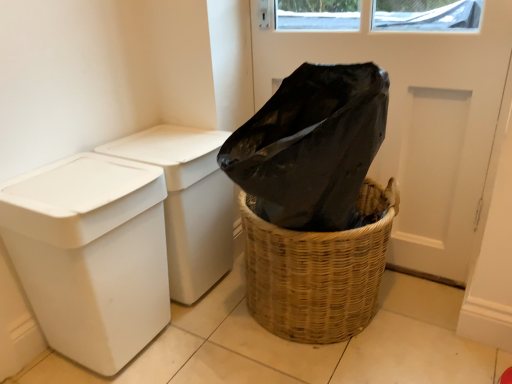
Where is `white plastic bin at left, marked as the 1th waste container in a back-to-front arrangement`? Image resolution: width=512 pixels, height=384 pixels. white plastic bin at left, marked as the 1th waste container in a back-to-front arrangement is located at coordinates pos(188,203).

In the image, is white plastic bin at left, which is the 1th waste container in front-to-back order, on the left side or the right side of black plastic screen door at upper center?

From the image, it's evident that white plastic bin at left, which is the 1th waste container in front-to-back order, is to the left of black plastic screen door at upper center.

From the image's perspective, would you say white plastic bin at left, which is counted as the second waste container, starting from the back, is shown under black plastic screen door at upper center?

Yes, from the image's perspective, white plastic bin at left, which is counted as the second waste container, starting from the back, is beneath black plastic screen door at upper center.

Considering the sizes of objects white plastic bin at left, which is the 1th waste container in front-to-back order, and black plastic screen door at upper center in the image provided, who is thinner, white plastic bin at left, which is the 1th waste container in front-to-back order, or black plastic screen door at upper center?

With smaller width is black plastic screen door at upper center.

Considering their positions, is white plastic bin at left, which is the 1th waste container in front-to-back order, located in front of or behind black plastic screen door at upper center?

Visually, white plastic bin at left, which is the 1th waste container in front-to-back order, is located in front of black plastic screen door at upper center.

From a real-world perspective, who is located lower, white plastic bin at left, which is the 2th waste container from front to back, or white plastic bin at left, which is counted as the second waste container, starting from the back?

white plastic bin at left, which is the 2th waste container from front to back.

Can you confirm if white plastic bin at left, marked as the 1th waste container in a back-to-front arrangement, is thinner than white plastic bin at left, which is the 1th waste container in front-to-back order?

Indeed, white plastic bin at left, marked as the 1th waste container in a back-to-front arrangement, has a lesser width compared to white plastic bin at left, which is the 1th waste container in front-to-back order.

Would you say white plastic bin at left, marked as the 1th waste container in a back-to-front arrangement, contains white plastic bin at left, which is counted as the second waste container, starting from the back?

Definitely not — white plastic bin at left, which is counted as the second waste container, starting from the back, is not inside white plastic bin at left, marked as the 1th waste container in a back-to-front arrangement.

Considering the positions of objects white plastic bin at left, marked as the 1th waste container in a back-to-front arrangement, and white plastic bin at left, which is counted as the second waste container, starting from the back, in the image provided, who is more to the left, white plastic bin at left, marked as the 1th waste container in a back-to-front arrangement, or white plastic bin at left, which is counted as the second waste container, starting from the back,?

From the viewer's perspective, white plastic bin at left, which is counted as the second waste container, starting from the back, appears more on the left side.

From a real-world perspective, who is located lower, white plastic bin at left, which is the 2th waste container from front to back, or woven brown basket at lower right?

woven brown basket at lower right.

From the image's perspective, which object appears higher, white plastic bin at left, marked as the 1th waste container in a back-to-front arrangement, or woven brown basket at lower right?

From the image's view, white plastic bin at left, marked as the 1th waste container in a back-to-front arrangement, is above.

Based on the photo, which object is further away from the camera, white plastic bin at left, which is the 2th waste container from front to back, or woven brown basket at lower right?

white plastic bin at left, which is the 2th waste container from front to back, is more distant.

Is woven brown basket at lower right surrounding black plastic screen door at upper center?

No, black plastic screen door at upper center is not a part of woven brown basket at lower right.

Does point (309, 280) appear closer or farther from the camera than point (505, 6)?

Point (309, 280) is farther from the camera than point (505, 6).

Considering the relative sizes of woven brown basket at lower right and black plastic screen door at upper center in the image provided, is woven brown basket at lower right thinner than black plastic screen door at upper center?

No, woven brown basket at lower right is not thinner than black plastic screen door at upper center.

Are woven brown basket at lower right and black plastic screen door at upper center far apart?

No, woven brown basket at lower right is in close proximity to black plastic screen door at upper center.

Is black plastic screen door at upper center turned away from white plastic bin at left, which is the 1th waste container in front-to-back order?

No, white plastic bin at left, which is the 1th waste container in front-to-back order, is not at the back of black plastic screen door at upper center.

Is point (451, 172) positioned before point (156, 318)?

No, (451, 172) is further to viewer.

What are the coordinates of `waste container in front of the black plastic screen door at upper center` in the screenshot? It's located at (91, 255).

Are black plastic screen door at upper center and white plastic bin at left, which is the 1th waste container in front-to-back order, beside each other?

They are not placed beside each other.

Between woven brown basket at lower right and white plastic bin at left, which is counted as the second waste container, starting from the back, which one is positioned in front?

white plastic bin at left, which is counted as the second waste container, starting from the back, is more forward.

Could you measure the distance between woven brown basket at lower right and white plastic bin at left, which is the 1th waste container in front-to-back order?

woven brown basket at lower right is 17.95 inches from white plastic bin at left, which is the 1th waste container in front-to-back order.

Is woven brown basket at lower right positioned with its back to white plastic bin at left, which is counted as the second waste container, starting from the back?

That's not correct — woven brown basket at lower right is not looking away from white plastic bin at left, which is counted as the second waste container, starting from the back.

Considering the points (387, 200) and (60, 219), which point is behind, point (387, 200) or point (60, 219)?

Point (387, 200)

Between point (119, 163) and point (229, 195), which one is positioned in front?

Point (119, 163)

Is white plastic bin at left, which is counted as the second waste container, starting from the back, bigger than white plastic bin at left, which is the 2th waste container from front to back?

Yes, white plastic bin at left, which is counted as the second waste container, starting from the back, is bigger than white plastic bin at left, which is the 2th waste container from front to back.

From the image's perspective, who appears lower, white plastic bin at left, which is the 1th waste container in front-to-back order, or white plastic bin at left, marked as the 1th waste container in a back-to-front arrangement?

From the image's view, white plastic bin at left, which is the 1th waste container in front-to-back order, is below.

At what (x,y) coordinates should I click in order to perform the action: click on waste container that appears on the right of white plastic bin at left, which is the 1th waste container in front-to-back order. Please return your answer as a coordinate pair (x, y). The height and width of the screenshot is (384, 512). Looking at the image, I should click on (188, 203).

Find the location of a particular element. The width and height of the screenshot is (512, 384). screen door above the white plastic bin at left, which is the 1th waste container in front-to-back order (from a real-world perspective) is located at coordinates (415, 114).

What are the coordinates of `waste container on the left of white plastic bin at left, marked as the 1th waste container in a back-to-front arrangement` in the screenshot? It's located at (91, 255).

Estimate the real-world distances between objects in this image. Which object is closer to white plastic bin at left, which is the 2th waste container from front to back, white plastic bin at left, which is the 1th waste container in front-to-back order, or woven brown basket at lower right?

Among the two, white plastic bin at left, which is the 1th waste container in front-to-back order, is located nearer to white plastic bin at left, which is the 2th waste container from front to back.

From the image, which object appears to be nearer to white plastic bin at left, which is the 1th waste container in front-to-back order, black plastic screen door at upper center or woven brown basket at lower right?

Based on the image, woven brown basket at lower right appears to be nearer to white plastic bin at left, which is the 1th waste container in front-to-back order.

From the image, which object appears to be farther from black plastic screen door at upper center, white plastic bin at left, which is the 2th waste container from front to back, or woven brown basket at lower right?

The object further to black plastic screen door at upper center is white plastic bin at left, which is the 2th waste container from front to back.

From the image, which object appears to be farther from white plastic bin at left, which is counted as the second waste container, starting from the back, black plastic screen door at upper center or white plastic bin at left, which is the 2th waste container from front to back?

Among the two, black plastic screen door at upper center is located further to white plastic bin at left, which is counted as the second waste container, starting from the back.

Which object lies further to the anchor point white plastic bin at left, marked as the 1th waste container in a back-to-front arrangement, black plastic screen door at upper center or white plastic bin at left, which is the 1th waste container in front-to-back order?

black plastic screen door at upper center lies further to white plastic bin at left, marked as the 1th waste container in a back-to-front arrangement, than the other object.

Looking at the image, which one is located further to woven brown basket at lower right, black plastic screen door at upper center or white plastic bin at left, which is the 1th waste container in front-to-back order?

white plastic bin at left, which is the 1th waste container in front-to-back order, is positioned further to the anchor woven brown basket at lower right.

From the image, which object appears to be nearer to black plastic screen door at upper center, white plastic bin at left, marked as the 1th waste container in a back-to-front arrangement, or white plastic bin at left, which is the 1th waste container in front-to-back order?

white plastic bin at left, marked as the 1th waste container in a back-to-front arrangement, is closer to black plastic screen door at upper center.

In the scene shown: Looking at the image, which one is located further to woven brown basket at lower right, white plastic bin at left, which is the 1th waste container in front-to-back order, or black plastic screen door at upper center?

white plastic bin at left, which is the 1th waste container in front-to-back order.

Find the location of `waste container located between white plastic bin at left, which is the 1th waste container in front-to-back order, and black plastic screen door at upper center in the left-right direction`. waste container located between white plastic bin at left, which is the 1th waste container in front-to-back order, and black plastic screen door at upper center in the left-right direction is located at coordinates (188, 203).

The image size is (512, 384). I want to click on waste container located between white plastic bin at left, which is counted as the second waste container, starting from the back, and woven brown basket at lower right in the left-right direction, so pos(188,203).

Locate an element on the screen. basket container between white plastic bin at left, which is the 2th waste container from front to back, and black plastic screen door at upper center, in the horizontal direction is located at coordinates (318, 270).

In order to click on basket container between white plastic bin at left, which is counted as the second waste container, starting from the back, and black plastic screen door at upper center, in the horizontal direction in this screenshot , I will do `click(318, 270)`.